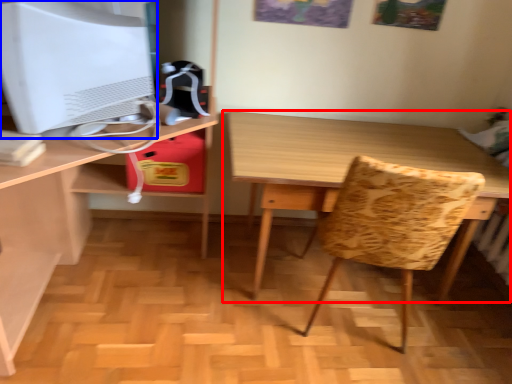
Question: Which object is further to the camera taking this photo, table (highlighted by a red box) or computer monitor (highlighted by a blue box)?

Choices:
 (A) table
 (B) computer monitor

Answer: (A)